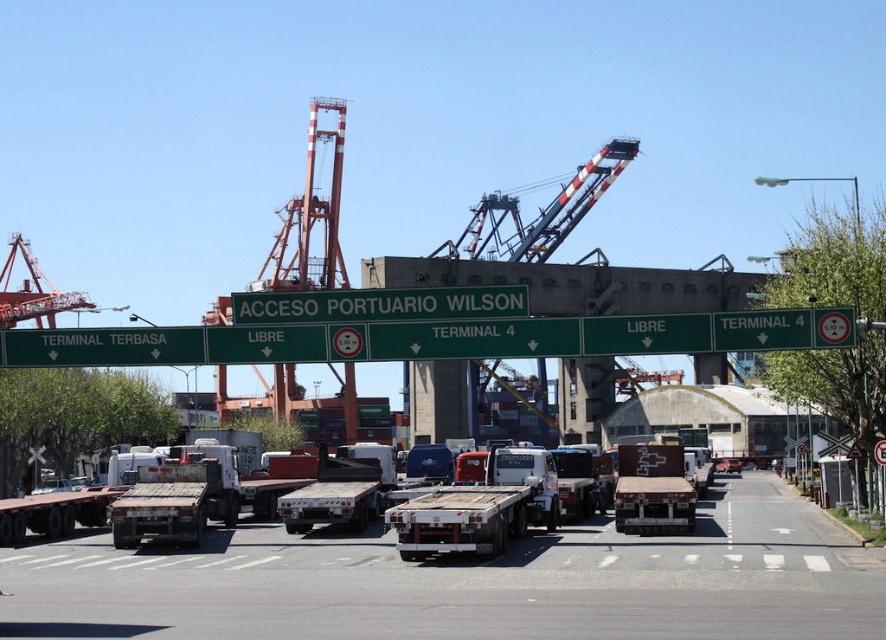
Question: Among these points, which one is nearest to the camera?

Choices:
 (A) (574, 568)
 (B) (21, 356)

Answer: (A)

Question: Is white matte truck at center smaller than green metallic signboard at left?

Choices:
 (A) no
 (B) yes

Answer: (A)

Question: Which point is farther to the camera?

Choices:
 (A) (358, 305)
 (B) (639, 353)

Answer: (A)

Question: Can you confirm if green metallic signboard at center is positioned to the left of green metallic signboard at left?

Choices:
 (A) yes
 (B) no

Answer: (B)

Question: Among these objects, which one is farthest from the camera?

Choices:
 (A) metallic red car at center
 (B) white matte truck at center
 (C) metallic flatbed trailer at center
 (D) green matte sign at center

Answer: (A)

Question: Can you confirm if green metallic signboard at left is positioned to the right of metallic red car at center?

Choices:
 (A) no
 (B) yes

Answer: (A)